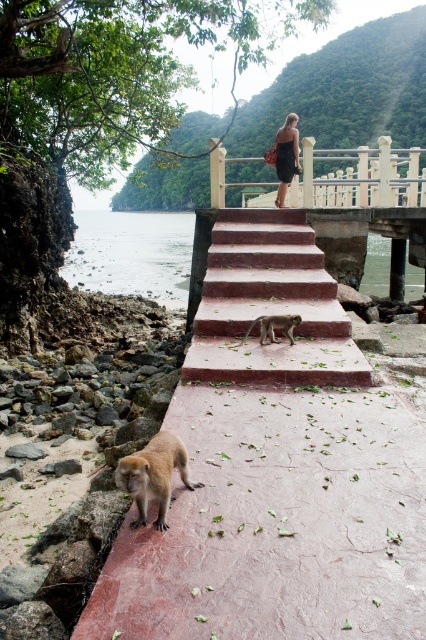
You are a photographer trying to capture a shot of the golden fur monkey at lower left without the smooth concrete stairs at center blocking the view. Is it possible to position yourself in a way that the monkey is visible without the stairs obstructing the shot?

The smooth concrete stairs at center is above the golden fur monkey at lower left, so if you position yourself lower or move to the side, you can capture the golden fur monkey at lower left without the stairs blocking the view.

You are standing at the top of the red stairs looking down towards the rocky shoreline. There are two points marked on the scene. Which of the two points, point (75,221) or point (144,504), is closer to you?

Point (75,221) is closer to you because it is further to the camera than point (144,504).

You are a photographer standing at the top of the red stairs. You want to take a photo of the clear water at lower left and the golden fur monkey at lower left. Which object is closer to the camera?

The clear water at lower left is positioned over the golden fur monkey at lower left, so the clear water at lower left is closer to the camera.